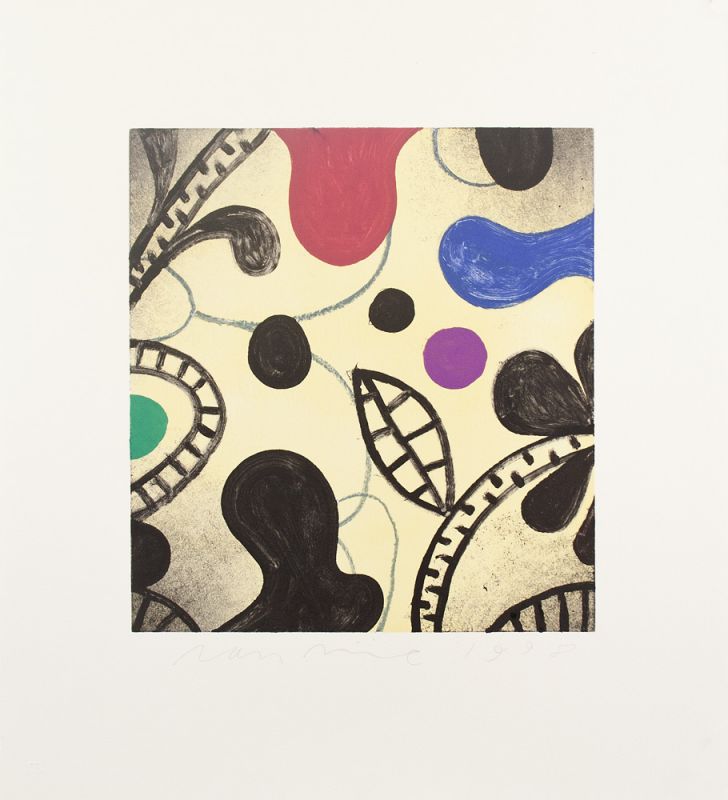
Find the location of a particular element. This screenshot has width=728, height=800. artwork is located at coordinates coord(346,369).